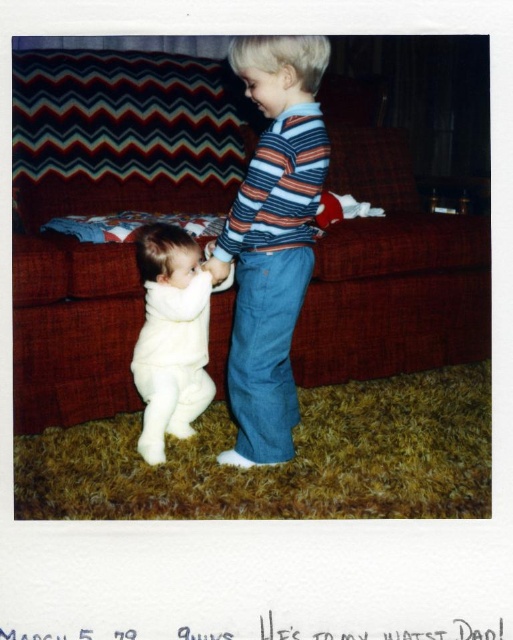
You are a photographer who wants to capture a photo of the striped cotton shirt at center and the white fuzzy onesie at lower left. Based on their positions, which one would appear closer to the camera in the final image?

The striped cotton shirt at center is taller than the white fuzzy onesie at lower left, so it would appear closer to the camera in the final image.